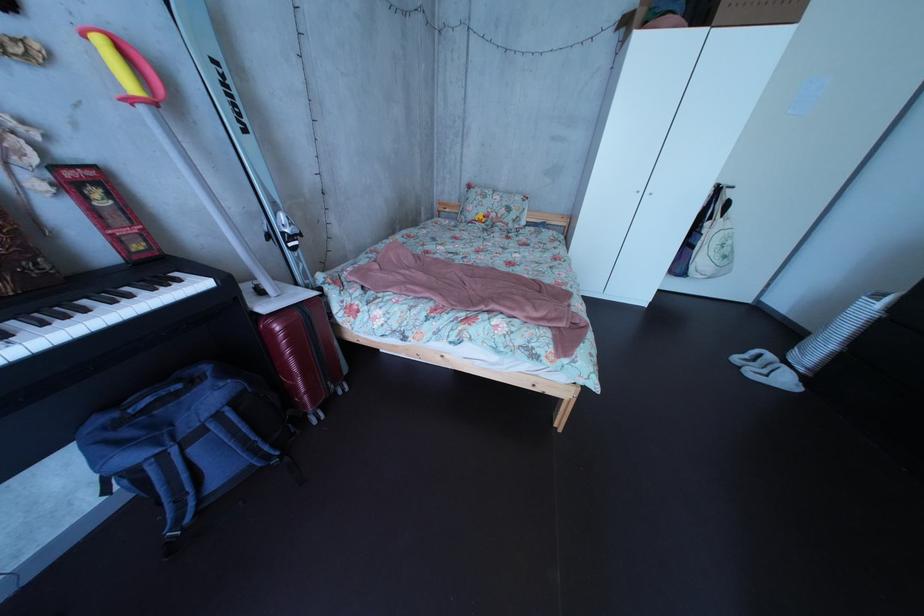
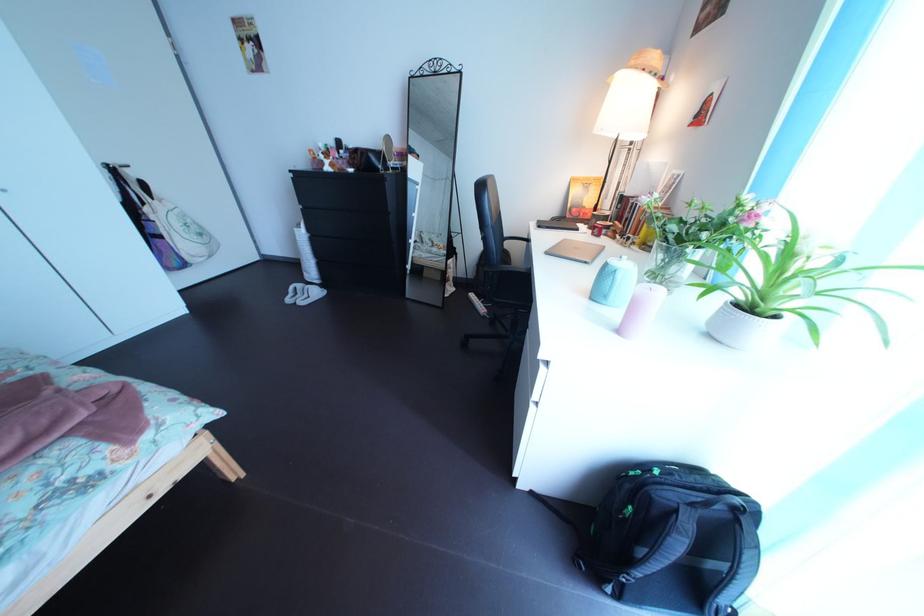
Looking at this image, first-person continuous shooting, in which direction is the camera rotating?

A: The rotation direction of the camera is right-down.